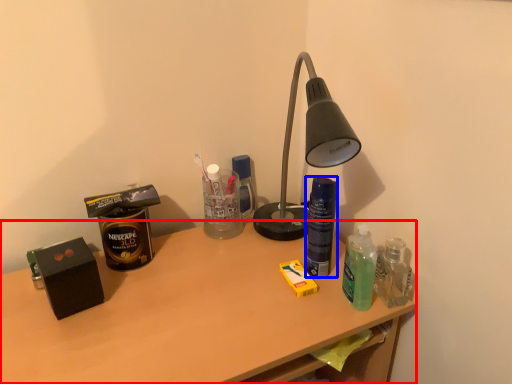
Question: Which object appears closest to the camera in this image, desk (highlighted by a red box) or bottle (highlighted by a blue box)?

Choices:
 (A) desk
 (B) bottle

Answer: (A)